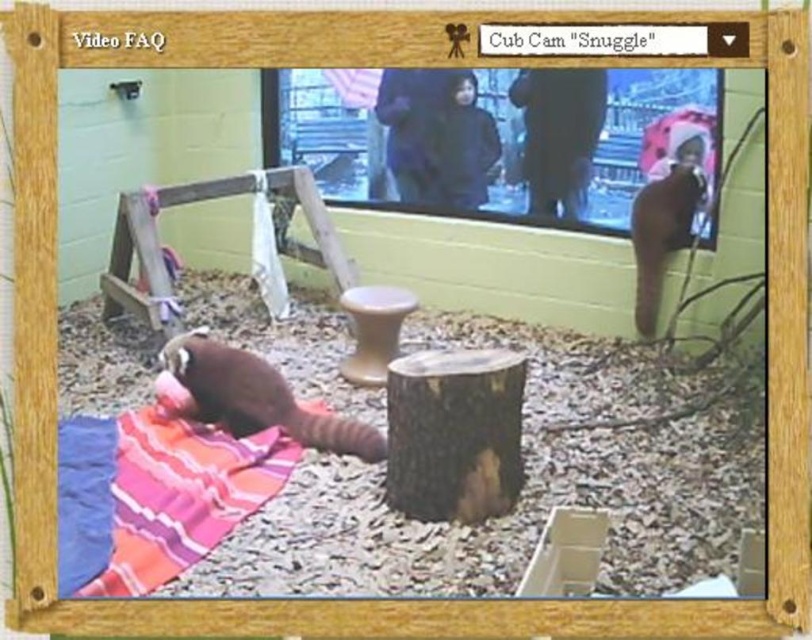
Who is taller, striped cotton blanket at lower left or smooth brown stool at center?

striped cotton blanket at lower left is taller.

Who is higher up, striped cotton blanket at lower left or smooth brown stool at center?

smooth brown stool at center is higher up.

Identify the location of striped cotton blanket at lower left. point(154,493).

Locate an element on the screen. Image resolution: width=812 pixels, height=640 pixels. striped cotton blanket at lower left is located at coordinates (154, 493).

Is brown fuzzy animal at lower left wider than smooth brown stool at center?

Indeed, brown fuzzy animal at lower left has a greater width compared to smooth brown stool at center.

In the scene shown: Does brown fuzzy animal at lower left have a larger size compared to smooth brown stool at center?

Correct, brown fuzzy animal at lower left is larger in size than smooth brown stool at center.

Does point (231, 433) come farther from viewer compared to point (372, 307)?

No, it is in front of (372, 307).

The height and width of the screenshot is (640, 812). I want to click on brown fuzzy animal at lower left, so click(258, 397).

Can you confirm if striped cotton blanket at lower left is taller than brown fuzzy animal at lower left?

Yes, striped cotton blanket at lower left is taller than brown fuzzy animal at lower left.

Does striped cotton blanket at lower left lie behind brown fuzzy animal at lower left?

No, striped cotton blanket at lower left is closer to the viewer.

Between point (188, 460) and point (188, 371), which one is positioned behind?

The point (188, 371) is behind.

Identify the location of striped cotton blanket at lower left. (154, 493).